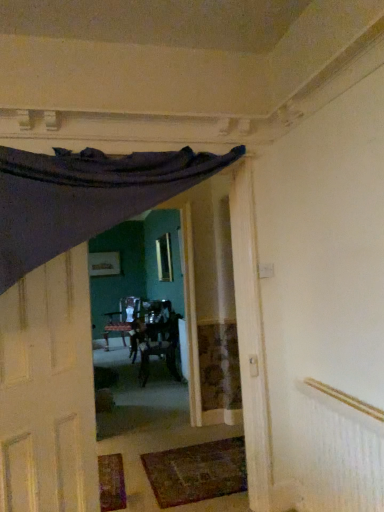
Question: From their relative heights in the image, would you say matte white door at left is taller or shorter than wooden textured chair at center?

Choices:
 (A) tall
 (B) short

Answer: (A)

Question: In the image, is matte white door at left on the left side or the right side of wooden textured chair at center?

Choices:
 (A) left
 (B) right

Answer: (A)

Question: Which object is positioned farthest from the white textured radiator at upper right?

Choices:
 (A) clear glass window at center
 (B) dark brown woven mat at lower center
 (C) matte white door at left
 (D) wooden textured chair at center

Answer: (A)

Question: Based on their relative distances, which object is farther from the matte white door at left?

Choices:
 (A) white textured radiator at upper right
 (B) wooden textured chair at center
 (C) dark brown woven mat at lower center
 (D) clear glass window at center

Answer: (D)